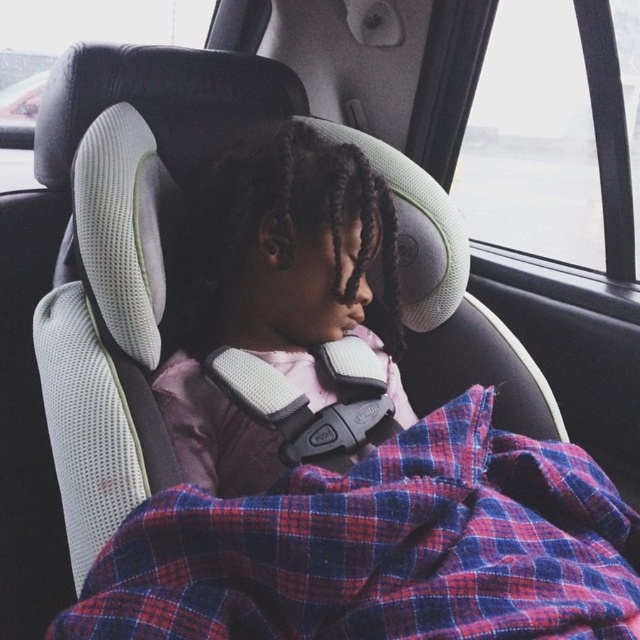
What do you see at coordinates (380, 548) in the screenshot? I see `plaid fabric at center` at bounding box center [380, 548].

Can you confirm if plaid fabric at center is shorter than matte pink fabric at center?

Yes, plaid fabric at center is shorter than matte pink fabric at center.

The width and height of the screenshot is (640, 640). Describe the element at coordinates (380, 548) in the screenshot. I see `plaid fabric at center` at that location.

You are a GUI agent. You are given a task and a screenshot of the screen. Output one action in this format:
    pyautogui.click(x=<x>, y=<y>)
    Task: Click on the plaid fabric at center
    The height and width of the screenshot is (640, 640).
    Given the screenshot: What is the action you would take?
    pyautogui.click(x=380, y=548)